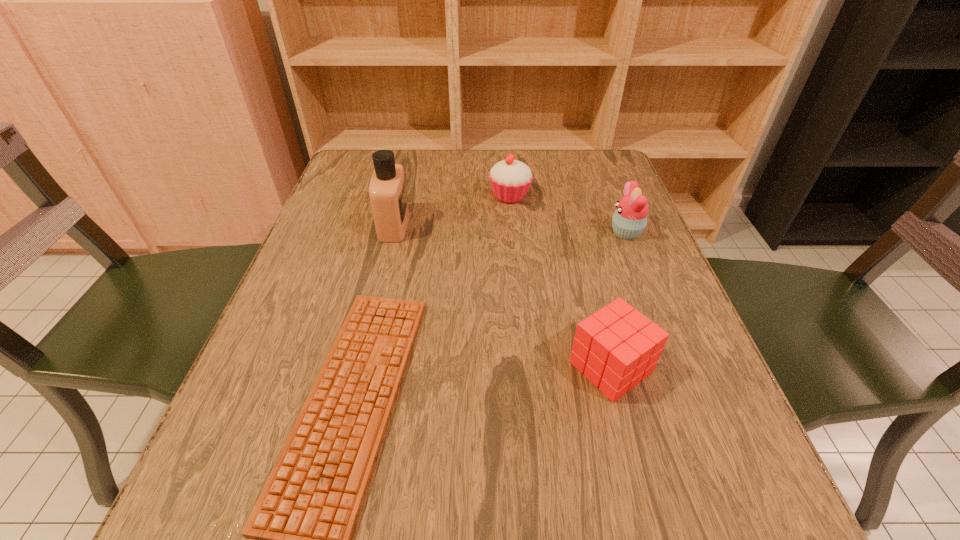
The width and height of the screenshot is (960, 540). Identify the location of blank space located on the face of the right cupcake. (556, 232).

Identify the location of vacant region located on the back of the farthest object. (506, 151).

Image resolution: width=960 pixels, height=540 pixels. I want to click on free point located 0.110m on the front of the fourth object from left to right, so pyautogui.click(x=639, y=476).

Identify the location of object that is at the far edge. This screenshot has width=960, height=540. (510, 179).

At what (x,y) coordinates should I click in order to perform the action: click on object present at the left edge. Please return your answer as a coordinate pair (x, y). This screenshot has height=540, width=960. Looking at the image, I should click on (387, 190).

At what (x,y) coordinates should I click in order to perform the action: click on cupcake located at the right edge. Please return your answer as a coordinate pair (x, y). Looking at the image, I should click on (630, 218).

The width and height of the screenshot is (960, 540). I want to click on cube that is at the right edge, so click(616, 347).

This screenshot has height=540, width=960. In the image, there is a desktop. Identify the location of vacant space at the far edge. (552, 181).

In the image, there is a desktop. Where is `blank space at the near edge`? This screenshot has height=540, width=960. blank space at the near edge is located at coordinates (535, 497).

Locate an element on the screen. vacant space at the left edge of the desktop is located at coordinates (371, 216).